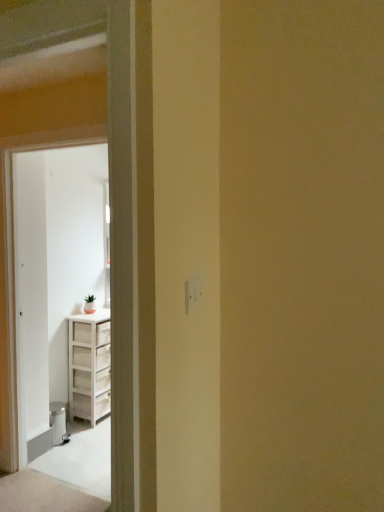
Find the location of a particular element. The height and width of the screenshot is (512, 384). vacant area on top of white wood cabinet at left (from a real-world perspective) is located at coordinates (64, 125).